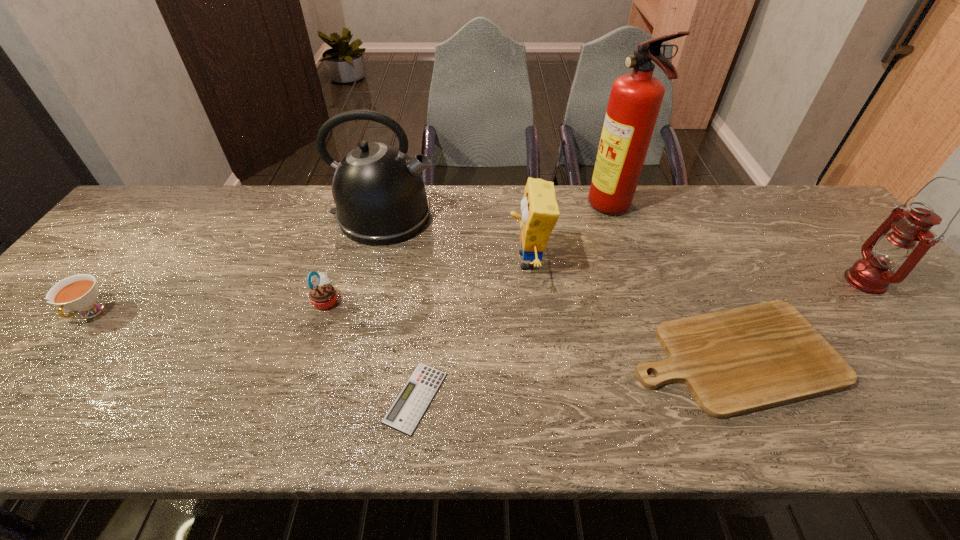
The width and height of the screenshot is (960, 540). I want to click on free space between the fire extinguisher and the kettle, so click(x=498, y=212).

The width and height of the screenshot is (960, 540). I want to click on vacant area between the fourth tallest object and the muffin, so click(427, 281).

The height and width of the screenshot is (540, 960). What are the coordinates of `empty space between the oil lamp and the kettle` in the screenshot? It's located at (624, 248).

Identify which object is the seventh closest to the tallest object. Please provide its 2D coordinates. Your answer should be formatted as a tuple, i.e. [(x, y)], where the tuple contains the x and y coordinates of a point satisfying the conditions above.

[(79, 292)]

Locate which object ranks third in proximity to the shortest object. Please provide its 2D coordinates. Your answer should be formatted as a tuple, i.e. [(x, y)], where the tuple contains the x and y coordinates of a point satisfying the conditions above.

[(379, 192)]

Image resolution: width=960 pixels, height=540 pixels. What are the coordinates of `blank space that satisfies the following two spatial constraints: 1. on the back side of the seventh tallest object; 2. on the face of the fourth object from right to left` in the screenshot? It's located at (688, 261).

The image size is (960, 540). What are the coordinates of `free space in the image that satisfies the following two spatial constraints: 1. on the front-facing side of the tallest object; 2. on the left side of the seventh tallest object` in the screenshot? It's located at (662, 356).

The height and width of the screenshot is (540, 960). Identify the location of free location that satisfies the following two spatial constraints: 1. on the face of the fifth object from left to right; 2. on the side of the teacup with the handle. (534, 313).

The height and width of the screenshot is (540, 960). Find the location of `vacant point that satisfies the following two spatial constraints: 1. on the side of the leftmost object with the handle; 2. on the left side of the calculator`. vacant point that satisfies the following two spatial constraints: 1. on the side of the leftmost object with the handle; 2. on the left side of the calculator is located at coordinates (24, 397).

Find the location of a particular element. This screenshot has width=960, height=540. vacant area in the image that satisfies the following two spatial constraints: 1. on the front-facing side of the seventh tallest object; 2. on the right side of the fifth tallest object is located at coordinates (308, 356).